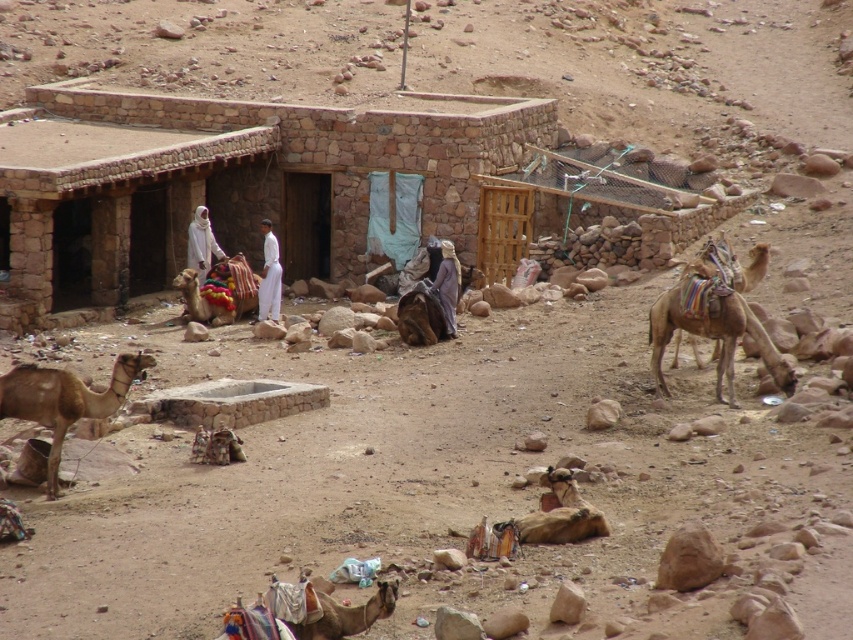
Question: Is the position of brown matte camel at lower left less distant than that of brown textured robe at center?

Choices:
 (A) yes
 (B) no

Answer: (A)

Question: Which of the following is the farthest from the observer?

Choices:
 (A) (202, 241)
 (B) (445, 310)
 (C) (117, 282)
 (D) (715, 333)

Answer: (A)

Question: Which object is positioned closest to the multicolored fabric-covered camel at center?

Choices:
 (A) brown stone hut at center
 (B) white cloth at center
 (C) multicolored fabric camel at lower center

Answer: (B)

Question: Where is brown textured camel at right located in relation to white clothed person at center in the image?

Choices:
 (A) right
 (B) left

Answer: (A)

Question: Is brown textured robe at center further to the viewer compared to white clothed person at center?

Choices:
 (A) no
 (B) yes

Answer: (A)

Question: Which object appears farthest from the camera in this image?

Choices:
 (A) brown textured camel at right
 (B) brown stone hut at center
 (C) brown fuzzy camel at center

Answer: (C)